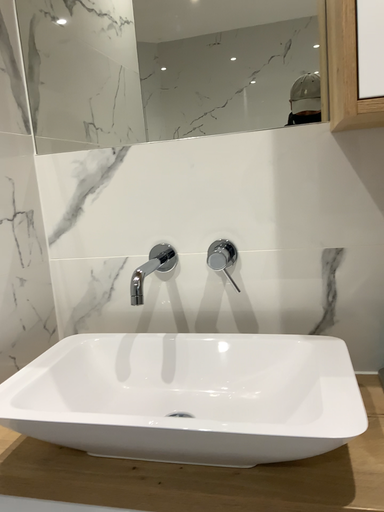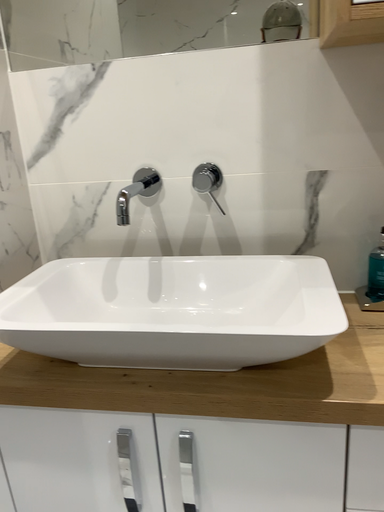
Question: Which way did the camera rotate in the video?

Choices:
 (A) rotated upward
 (B) rotated downward

Answer: (B)